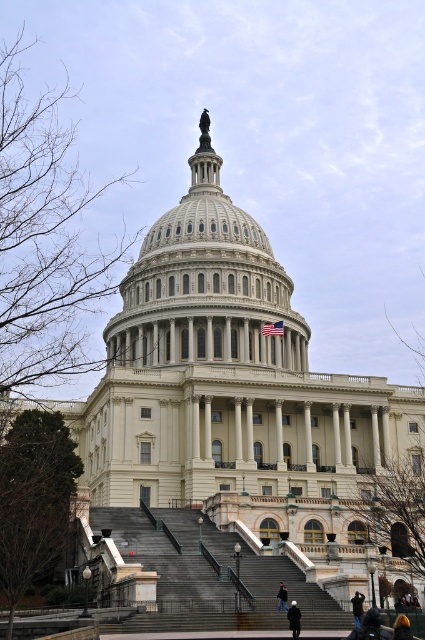
Question: Which point appears farthest from the camera in this image?

Choices:
 (A) (357, 620)
 (B) (286, 595)
 (C) (408, 630)
 (D) (266, 614)

Answer: (B)

Question: Is white marble dome at center positioned behind gray concrete stairs at center?

Choices:
 (A) yes
 (B) no

Answer: (A)

Question: Is gray concrete stairs at center above black fabric person at center?

Choices:
 (A) no
 (B) yes

Answer: (B)

Question: Which object appears closest to the camera in this image?

Choices:
 (A) white marble dome at center
 (B) black leather jacket at lower right
 (C) black fabric person at center

Answer: (B)

Question: Does dark blue jeans at lower center appear over black fabric person at center?

Choices:
 (A) no
 (B) yes

Answer: (B)

Question: Which point is closer to the camera taking this photo?

Choices:
 (A) (234, 616)
 (B) (195, 308)

Answer: (A)